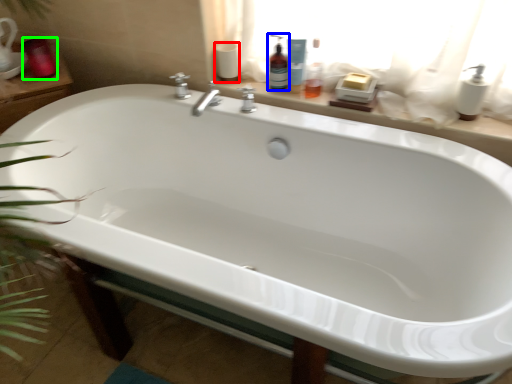
Question: Which is nearer to the toilet paper (highlighted by a red box)? cleaning product (highlighted by a blue box) or toiletry (highlighted by a green box).

Choices:
 (A) cleaning product
 (B) toiletry

Answer: (A)